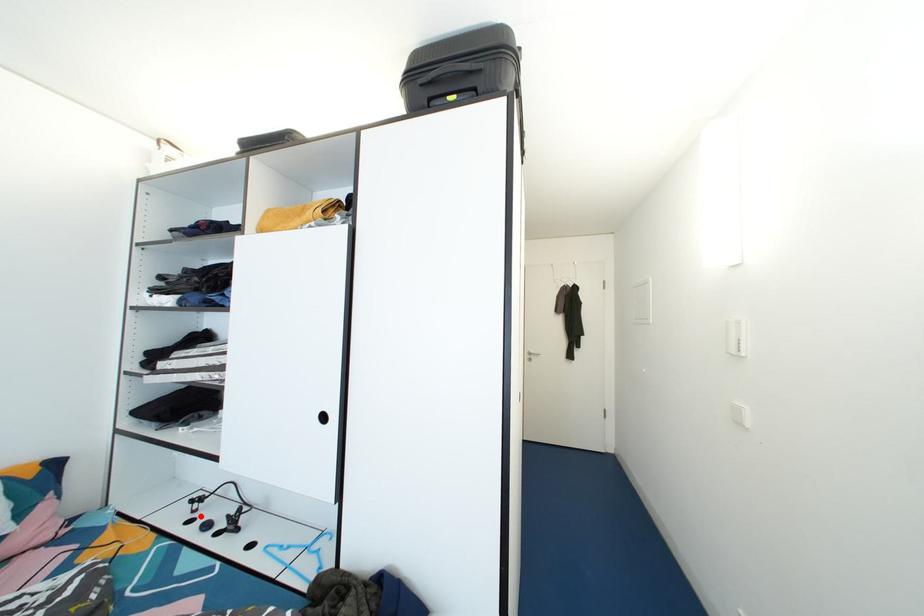
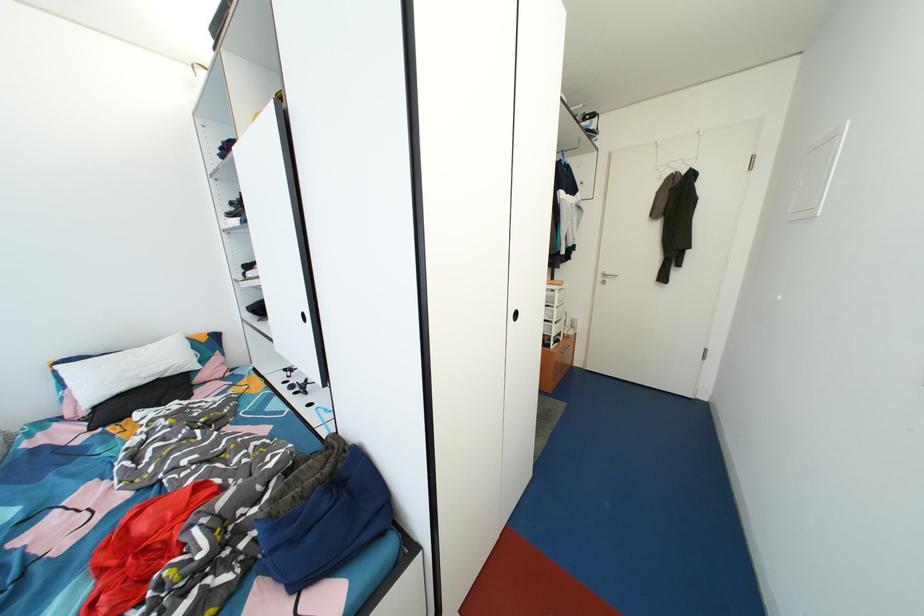
Question: I am providing you with two images of the same scene from different viewpoints. A red point is shown in image1. For the corresponding object point in image2, is it positioned nearer or farther from the camera?

Choices:
 (A) Nearer
 (B) Farther

Answer: (B)